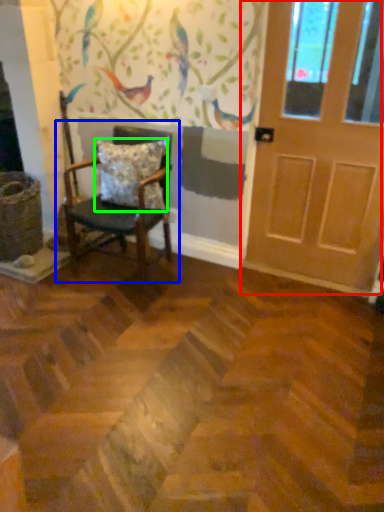
Question: Considering the real-world distances, which object is closest to door (highlighted by a red box)? chair (highlighted by a blue box) or pillow (highlighted by a green box).

Choices:
 (A) chair
 (B) pillow

Answer: (B)